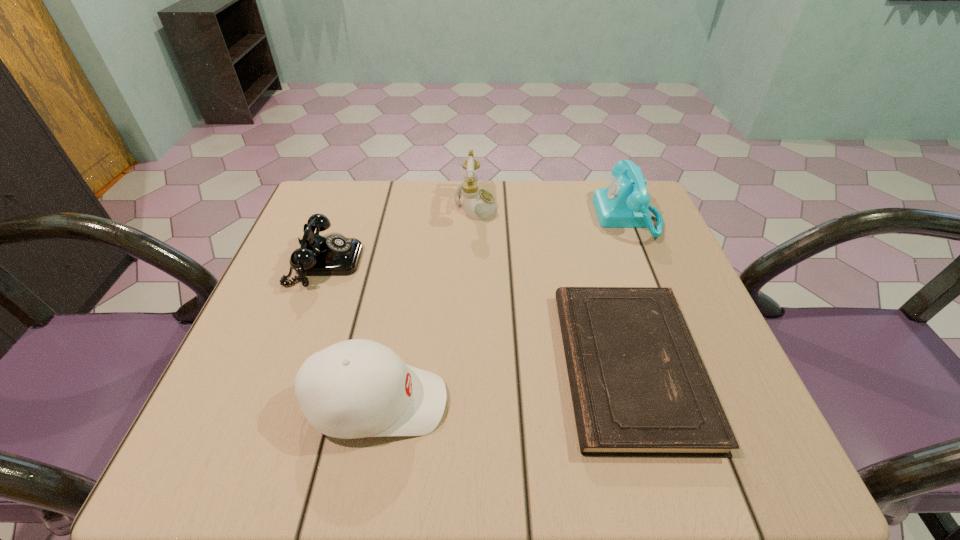
This screenshot has width=960, height=540. I want to click on free location that satisfies the following two spatial constraints: 1. on the dial of the shortest telephone; 2. on the back side of the paperback book, so click(286, 366).

Locate an element on the screen. vacant space that satisfies the following two spatial constraints: 1. on the dial of the second telephone from left to right; 2. on the left side of the paperback book is located at coordinates (473, 366).

In order to click on free location that satisfies the following two spatial constraints: 1. on the dial of the second telephone from left to right; 2. on the back side of the shortest object in this screenshot , I will do `click(473, 366)`.

Identify the location of vacant area in the image that satisfies the following two spatial constraints: 1. on the dial of the second telephone from right to left; 2. on the left side of the paperback book. The height and width of the screenshot is (540, 960). (473, 366).

I want to click on vacant area in the image that satisfies the following two spatial constraints: 1. on the dial of the second shortest object; 2. on the left side of the paperback book, so click(286, 366).